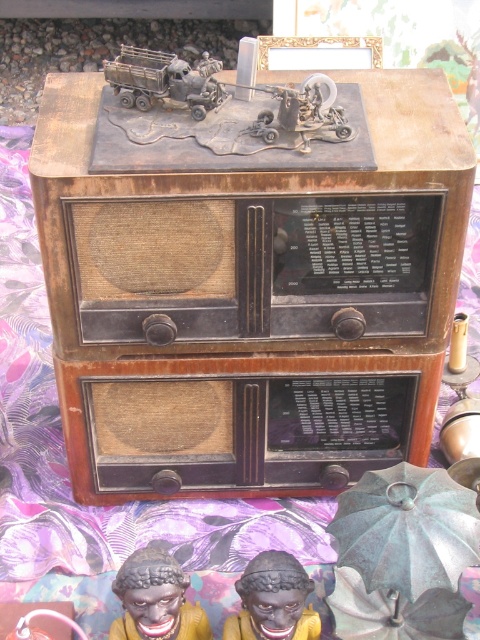
Question: Does green matte umbrella at center have a lesser width compared to black matte figurine at lower center?

Choices:
 (A) no
 (B) yes

Answer: (A)

Question: Which is farther from the brown wood table at center?

Choices:
 (A) green matte umbrella at center
 (B) black matte clown mask at lower center
 (C) matte black figurine at lower left

Answer: (C)

Question: Can you confirm if black matte clown mask at lower center is positioned to the left of matte black figurine at lower left?

Choices:
 (A) yes
 (B) no

Answer: (B)

Question: Which object is positioned farthest from the metallic gray truck at upper center?

Choices:
 (A) matte black figurine at lower left
 (B) green matte umbrella at center

Answer: (A)

Question: Considering the relative positions of black matte clown mask at lower center and metallic gray truck at upper center in the image provided, where is black matte clown mask at lower center located with respect to metallic gray truck at upper center?

Choices:
 (A) left
 (B) right

Answer: (A)

Question: Which point appears closest to the camera in this image?

Choices:
 (A) tap(121, 592)
 (B) tap(416, 605)
 (C) tap(141, 64)
 (D) tap(269, 344)

Answer: (A)